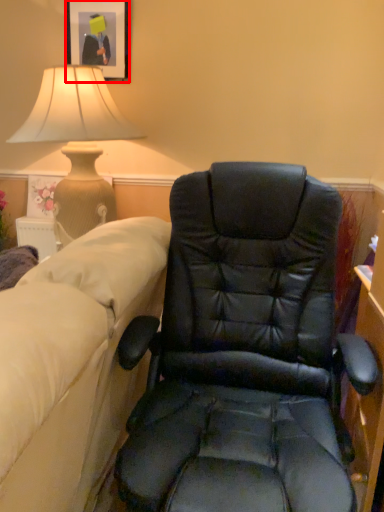
Question: Where is picture frame (annotated by the red box) located in relation to chair in the image?

Choices:
 (A) left
 (B) right

Answer: (A)